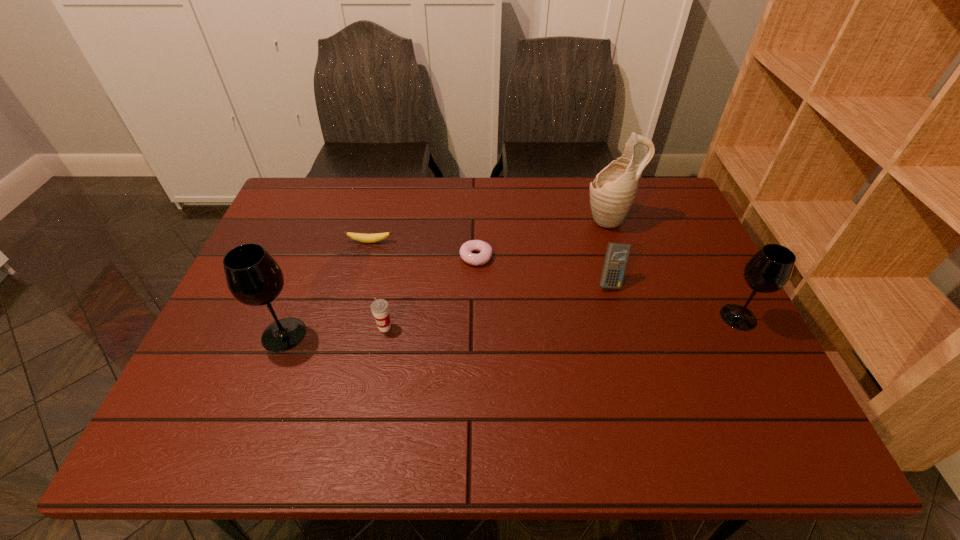
In order to click on object that is at the left edge in this screenshot , I will do `click(254, 278)`.

Identify the location of wineglass present at the right edge. The image size is (960, 540). (769, 270).

I want to click on pitcher that is at the right edge, so click(612, 193).

You are a GUI agent. You are given a task and a screenshot of the screen. Output one action in this format:
    pyautogui.click(x=<x>, y=<y>)
    Task: Click on the object situated at the far right corner
    Image resolution: width=960 pixels, height=540 pixels.
    Given the screenshot: What is the action you would take?
    pyautogui.click(x=612, y=193)

Where is `free space at the far edge of the desktop`? free space at the far edge of the desktop is located at coordinates (470, 199).

In the image, there is a desktop. Identify the location of vacant space at the near edge. (612, 373).

In the image, there is a desktop. Where is `vacant area at the left edge`? vacant area at the left edge is located at coordinates (278, 259).

Find the location of `vacant space at the right edge of the desktop`. vacant space at the right edge of the desktop is located at coordinates (672, 225).

Image resolution: width=960 pixels, height=540 pixels. In the image, there is a desktop. What are the coordinates of `free space at the far left corner` in the screenshot? It's located at (286, 205).

At what (x,y) coordinates should I click in order to perform the action: click on free region at the far right corner. Please return your answer as a coordinate pair (x, y). The width and height of the screenshot is (960, 540). Looking at the image, I should click on (663, 211).